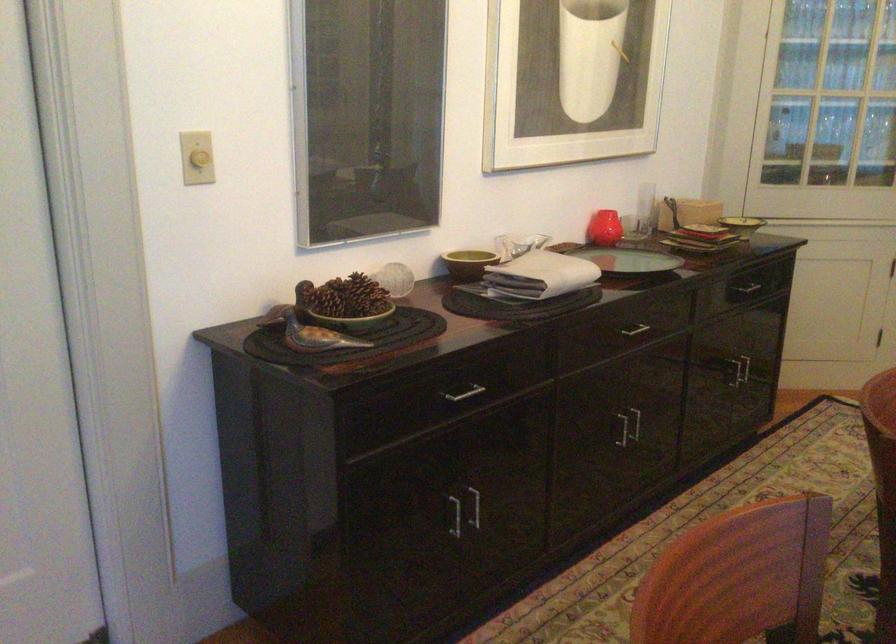
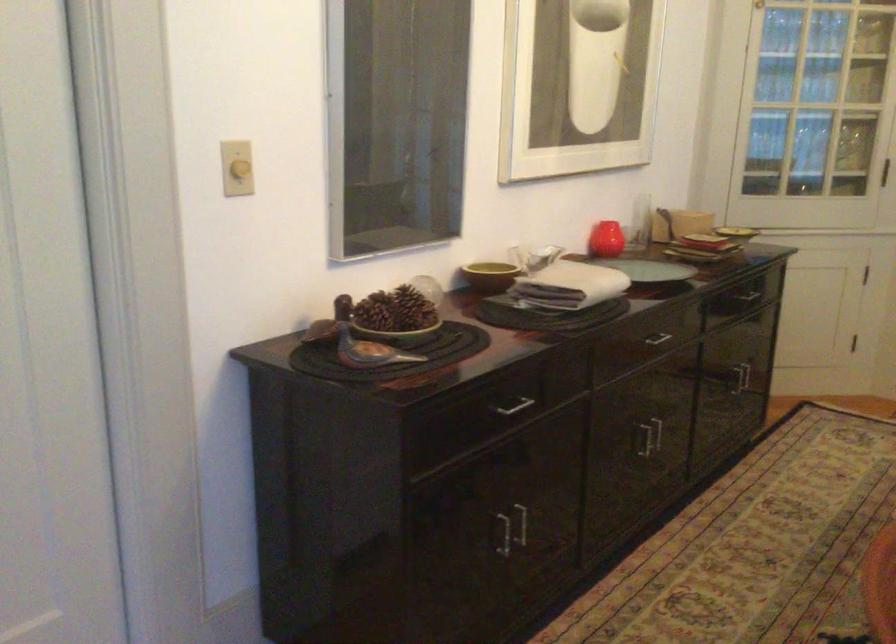
Question: What movement of the cameraman would produce the second image?

Choices:
 (A) Left
 (B) Right
 (C) Forward
 (D) Backward

Answer: (A)